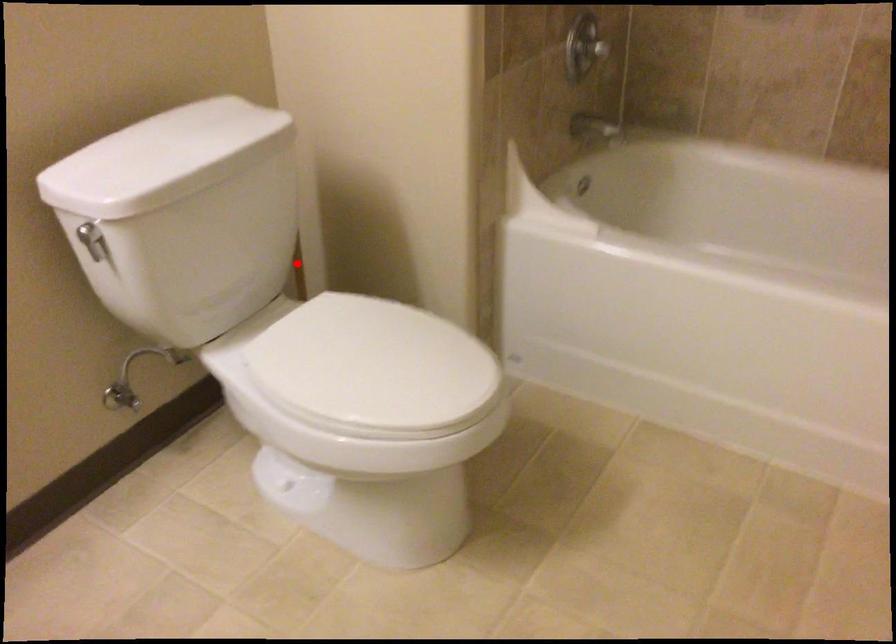
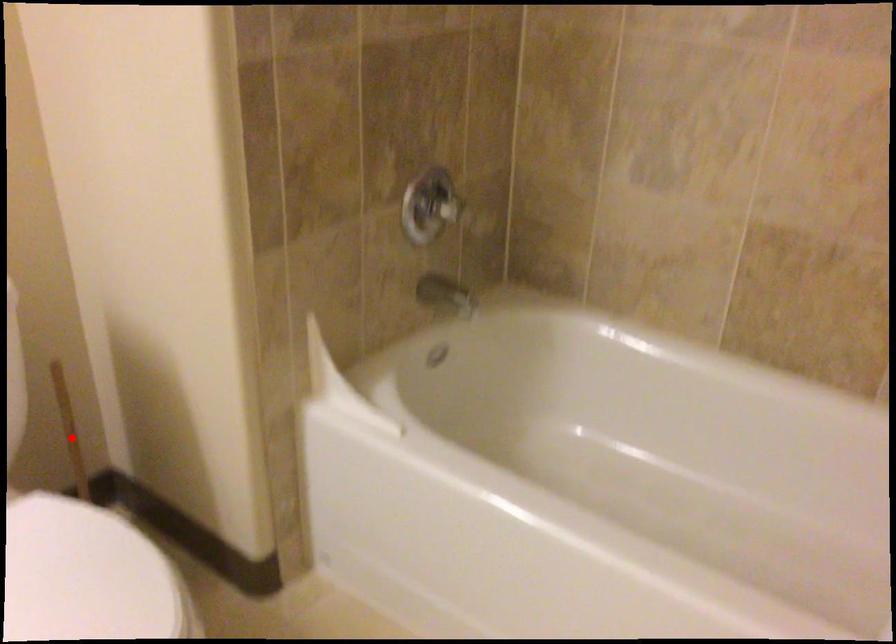
I am providing you with two images of the same scene from different viewpoints. A red point is marked on the first image and another point is marked on the second image. Do the highlighted points in image1 and image2 indicate the same real-world spot?

Yes